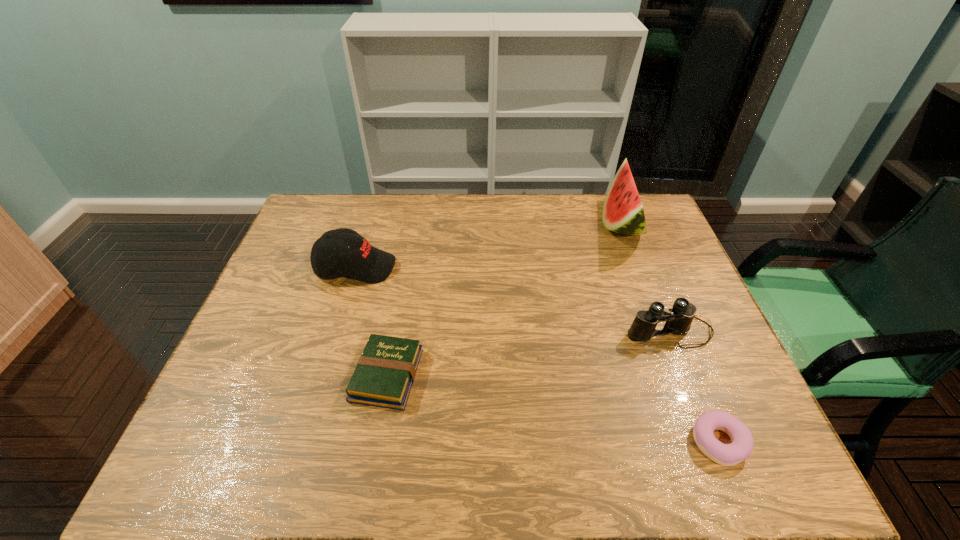
At what (x,y) coordinates should I click in order to perform the action: click on free spot between the pastry and the baseball cap. Please return your answer as a coordinate pair (x, y). Looking at the image, I should click on (538, 355).

Find the location of a particular element. free point between the binoculars and the book is located at coordinates (528, 353).

Where is `free spot between the book and the binoculars`? Image resolution: width=960 pixels, height=540 pixels. free spot between the book and the binoculars is located at coordinates (528, 353).

Identify which object is the nearest to the binoculars. Please provide its 2D coordinates. Your answer should be formatted as a tuple, i.e. [(x, y)], where the tuple contains the x and y coordinates of a point satisfying the conditions above.

[(741, 447)]

This screenshot has height=540, width=960. What are the coordinates of `object that stands as the third closest to the book` in the screenshot? It's located at (741, 447).

Locate an element on the screen. This screenshot has width=960, height=540. free space in the image that satisfies the following two spatial constraints: 1. on the front-facing side of the baseball cap; 2. on the right side of the pastry is located at coordinates (304, 442).

I want to click on vacant space that satisfies the following two spatial constraints: 1. on the back side of the binoculars; 2. on the outer rind of the watermelon, so click(x=627, y=224).

You are a GUI agent. You are given a task and a screenshot of the screen. Output one action in this format:
    pyautogui.click(x=<x>, y=<y>)
    Task: Click on the free point that satisfies the following two spatial constraints: 1. on the front-facing side of the baseball cap; 2. on the back side of the binoculars
    This screenshot has width=960, height=540.
    Given the screenshot: What is the action you would take?
    pyautogui.click(x=337, y=331)

The image size is (960, 540). I want to click on free spot that satisfies the following two spatial constraints: 1. on the front-facing side of the baseball cap; 2. on the left side of the pastry, so click(x=304, y=442).

Find the location of a particular element. vacant point that satisfies the following two spatial constraints: 1. on the outer rind of the watermelon; 2. on the left side of the nearest object is located at coordinates (703, 442).